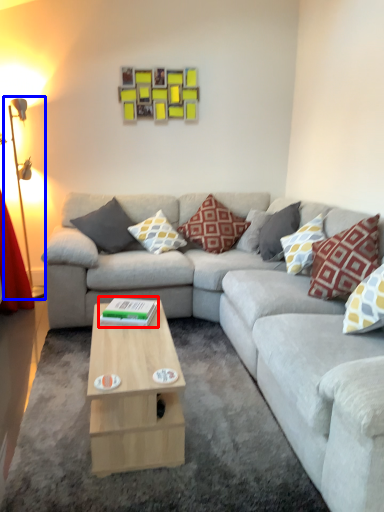
Question: Which object is further to the camera taking this photo, book (highlighted by a red box) or table lamp (highlighted by a blue box)?

Choices:
 (A) book
 (B) table lamp

Answer: (B)